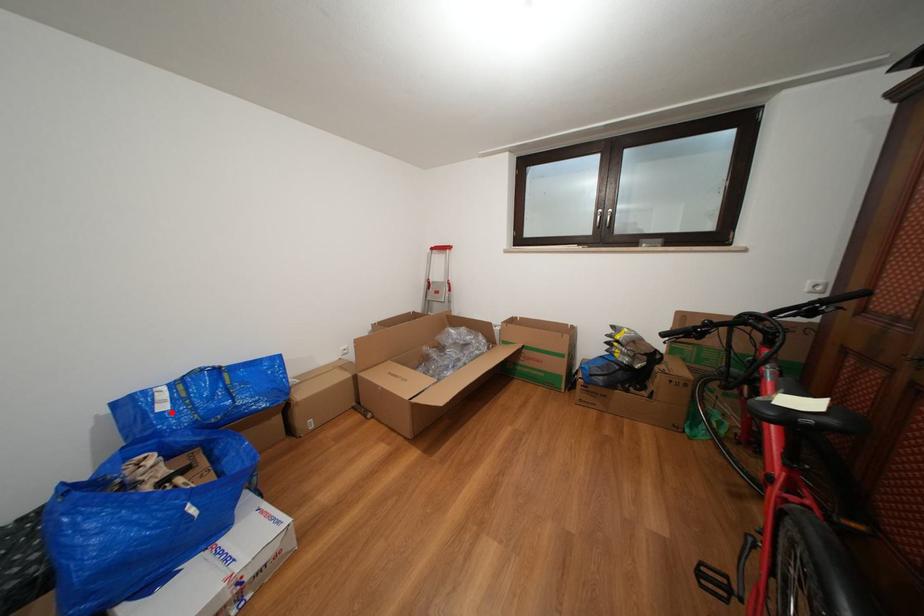
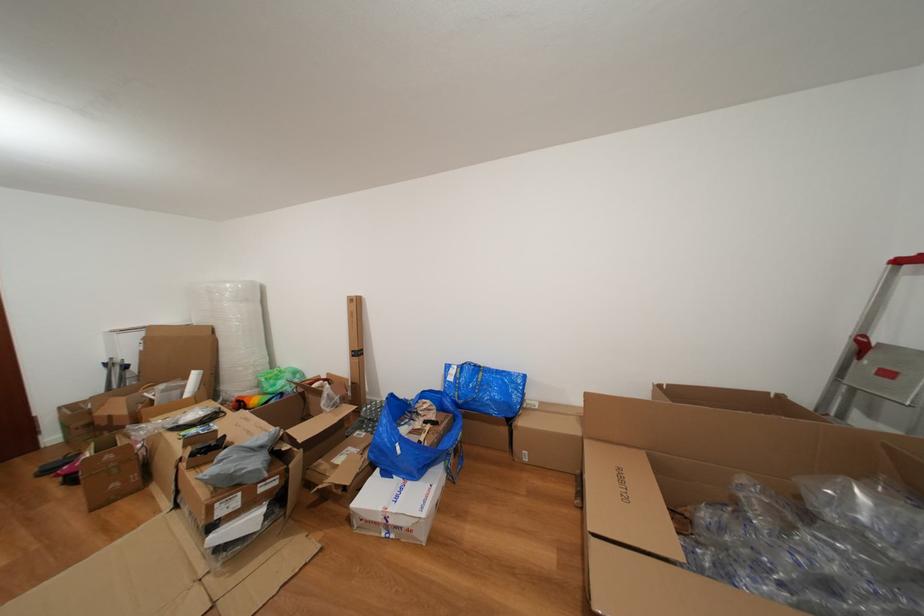
In the second image, find the point that corresponds to the highlighted location in the first image.

(458, 384)